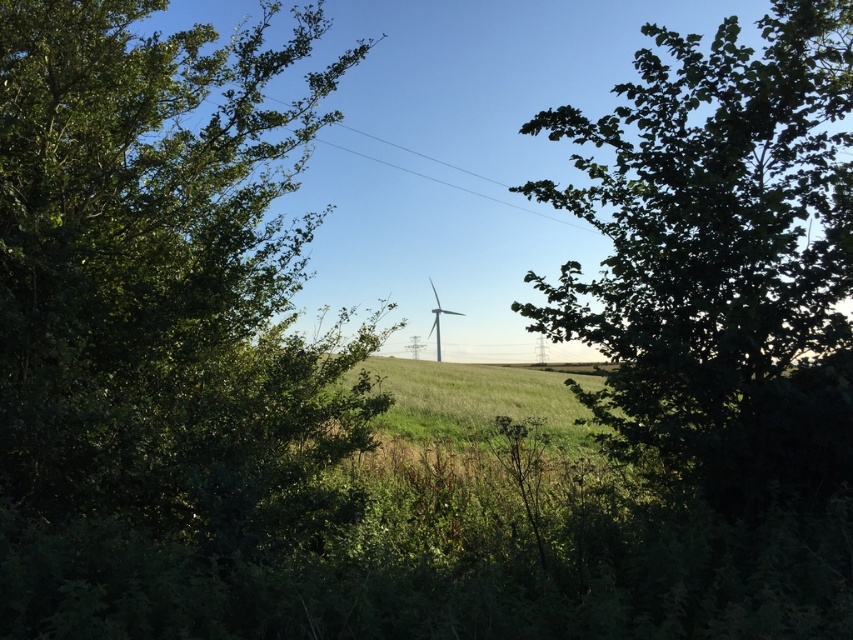
You are an environmental scientist analyzing the image. You need to determine which tree, the green leafy tree at left or the green leafy tree at center, is closer to the observer based on their sizes. Which one is closer?

The green leafy tree at left is closer to the observer because it has a larger size compared to the green leafy tree at center.

You are a bird flying over the rural landscape and want to land on the highest point between the green leafy tree at left and the white matte wind turbine at center. Which one should you choose?

The green leafy tree at left is much taller than the white matte wind turbine at center, so you should choose the green leafy tree at left to land on the highest point.

You are a bird looking for a nesting spot. You see two trees in the scene, the green leafy tree at left and the green leafy tree at center. Which tree would you choose if you prefer nesting in the taller tree?

The green leafy tree at left is taller than the green leafy tree at center, so the bird should choose the green leafy tree at left for nesting.